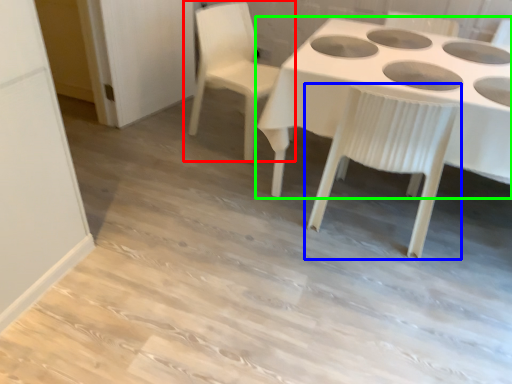
Question: Which is nearer to the chair (highlighted by a red box)? chair (highlighted by a blue box) or table (highlighted by a green box).

Choices:
 (A) chair
 (B) table

Answer: (B)